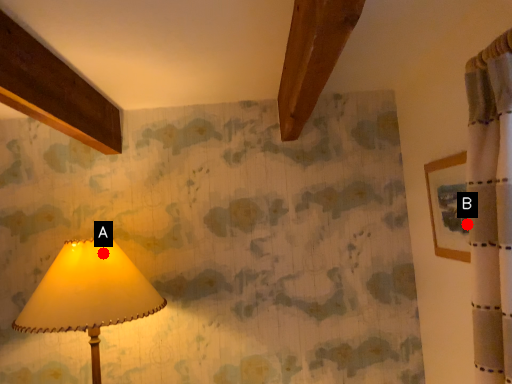
Question: Two points are circled on the image, labeled by A and B beside each circle. Which point is further to the camera?

Choices:
 (A) A is further
 (B) B is further

Answer: (A)